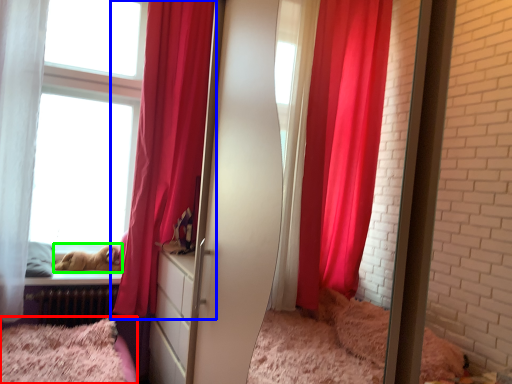
Question: Estimate the real-world distances between objects in this image. Which object is closer to bed (highlighted by a red box), curtain (highlighted by a blue box) or animal (highlighted by a green box)?

Choices:
 (A) curtain
 (B) animal

Answer: (B)